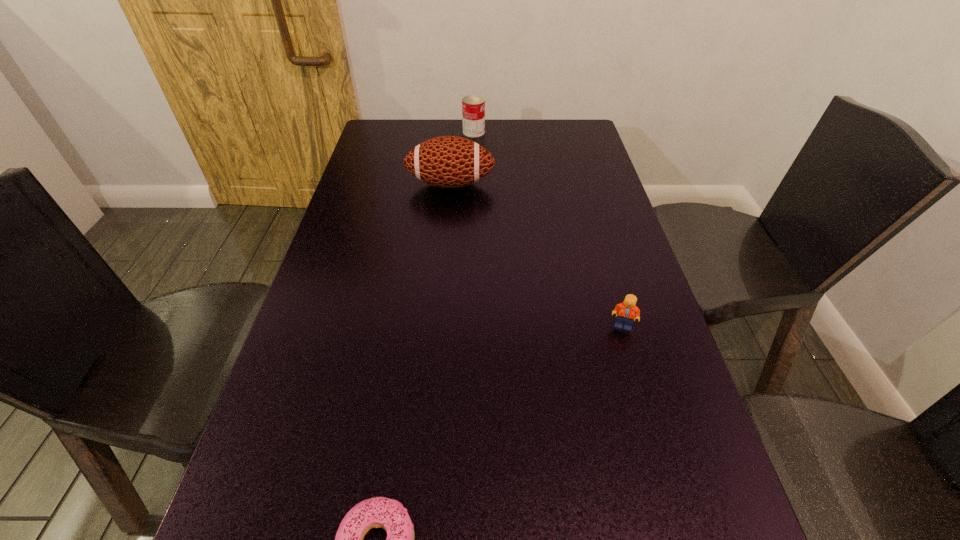
The width and height of the screenshot is (960, 540). In order to click on object that is at the right edge in this screenshot , I will do `click(625, 312)`.

Image resolution: width=960 pixels, height=540 pixels. What are the coordinates of `free space at the far edge of the desktop` in the screenshot? It's located at (487, 119).

The image size is (960, 540). Find the location of `vacant space at the left edge of the desktop`. vacant space at the left edge of the desktop is located at coordinates (352, 192).

Image resolution: width=960 pixels, height=540 pixels. I want to click on free location at the right edge of the desktop, so click(552, 153).

You are a GUI agent. You are given a task and a screenshot of the screen. Output one action in this format:
    pyautogui.click(x=<x>, y=<y>)
    Task: Click on the vacant space at the far right corner
    The height and width of the screenshot is (540, 960).
    Given the screenshot: What is the action you would take?
    pyautogui.click(x=579, y=127)

This screenshot has height=540, width=960. I want to click on vacant area that lies between the football and the Lego, so click(537, 255).

Where is `empty location between the farthest object and the third farthest object`? The height and width of the screenshot is (540, 960). empty location between the farthest object and the third farthest object is located at coordinates tap(548, 229).

The image size is (960, 540). I want to click on blank region between the Lego and the farthest object, so click(x=548, y=229).

Find the location of `free space between the third shortest object and the rightmost object`. free space between the third shortest object and the rightmost object is located at coordinates [548, 229].

Find the location of a particular element. The image size is (960, 540). vacant point located between the football and the Lego is located at coordinates (537, 255).